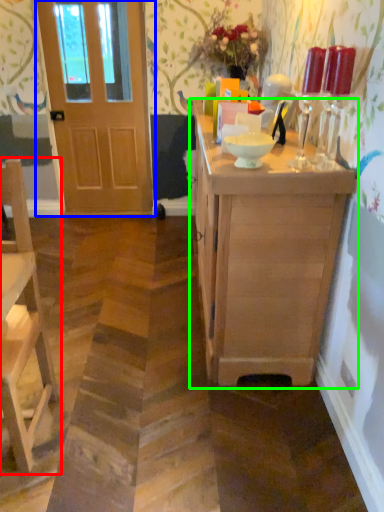
Question: Which is farther away from chair (highlighted by a red box)? door (highlighted by a blue box) or cabinetry (highlighted by a green box)?

Choices:
 (A) door
 (B) cabinetry

Answer: (A)